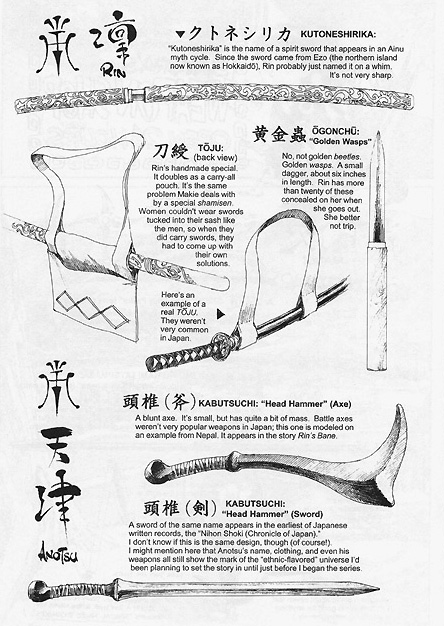
This screenshot has width=444, height=626. In order to click on ornamental sword shield in this screenshot , I will do `click(295, 93)`.